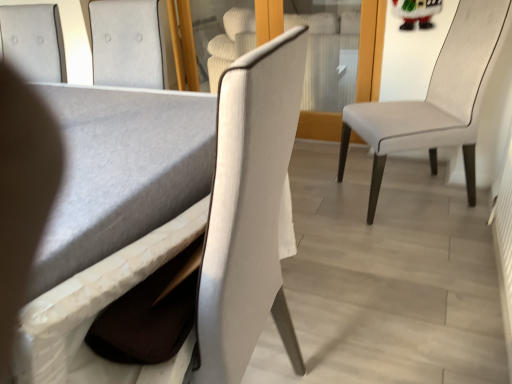
At what (x,y) coordinates should I click in order to perform the action: click on white leather chair at right, placed as the 1th chair when sorted from right to left. Please return your answer as a coordinate pair (x, y). Looking at the image, I should click on (437, 98).

What do you see at coordinates (33, 41) in the screenshot?
I see `textured gray cushion at upper left, marked as the third chair in a right-to-left arrangement` at bounding box center [33, 41].

Locate an element on the screen. matte gray table at lower left is located at coordinates (121, 171).

Describe the element at coordinates (319, 60) in the screenshot. I see `transparent glass door at center` at that location.

Where is `white leather chair at right, which is counted as the 3th chair, starting from the left`? white leather chair at right, which is counted as the 3th chair, starting from the left is located at coordinates 437,98.

From the image's perspective, which one is positioned higher, matte white chair at center, which ranks as the 2th chair in left-to-right order, or textured gray cushion at upper left, marked as the first chair in a left-to-right arrangement?

From the image's view, textured gray cushion at upper left, marked as the first chair in a left-to-right arrangement, is above.

Which point is more forward, (75, 317) or (24, 26)?

The point (75, 317) is more forward.

Is there a large distance between matte white chair at center, which is counted as the second chair, starting from the right, and textured gray cushion at upper left, marked as the first chair in a left-to-right arrangement?

No, there isn't a large distance between matte white chair at center, which is counted as the second chair, starting from the right, and textured gray cushion at upper left, marked as the first chair in a left-to-right arrangement.

Is matte white chair at center, which is counted as the second chair, starting from the right, taller or shorter than transparent glass door at center?

Considering their sizes, matte white chair at center, which is counted as the second chair, starting from the right, has more height than transparent glass door at center.

What's the angular difference between matte white chair at center, which is counted as the second chair, starting from the right, and transparent glass door at center's facing directions?

The angular difference between matte white chair at center, which is counted as the second chair, starting from the right, and transparent glass door at center is 92.2 degrees.

Considering the points (232, 283) and (311, 120), which point is behind, point (232, 283) or point (311, 120)?

The point (311, 120) is farther.

From the image's perspective, which is below, matte white chair at center, which is counted as the second chair, starting from the right, or transparent glass door at center?

matte white chair at center, which is counted as the second chair, starting from the right, from the image's perspective.

Is point (110, 148) more distant than point (307, 99)?

No, it is not.

Does matte gray table at lower left have a larger size compared to transparent glass door at center?

Actually, matte gray table at lower left might be smaller than transparent glass door at center.

Are matte gray table at lower left and transparent glass door at center located far from each other?

matte gray table at lower left is positioned a significant distance from transparent glass door at center.

Are transparent glass door at center and white leather chair at right, placed as the 1th chair when sorted from right to left, far apart?

No.

Where is `glass door on the left of the white leather chair at right, which is counted as the 3th chair, starting from the left`? glass door on the left of the white leather chair at right, which is counted as the 3th chair, starting from the left is located at coordinates pyautogui.click(x=319, y=60).

How far apart are transparent glass door at center and white leather chair at right, which is counted as the 3th chair, starting from the left?

transparent glass door at center is 27.21 inches away from white leather chair at right, which is counted as the 3th chair, starting from the left.

Considering the relative sizes of transparent glass door at center and white leather chair at right, placed as the 1th chair when sorted from right to left, in the image provided, is transparent glass door at center taller than white leather chair at right, placed as the 1th chair when sorted from right to left,?

Incorrect, the height of transparent glass door at center is not larger of that of white leather chair at right, placed as the 1th chair when sorted from right to left.

Relative to white leather chair at right, which is counted as the 3th chair, starting from the left, is matte white chair at center, which is counted as the second chair, starting from the right, in front or behind?

Clearly, matte white chair at center, which is counted as the second chair, starting from the right, is in front of white leather chair at right, which is counted as the 3th chair, starting from the left.

From the image's perspective, between matte white chair at center, which is counted as the second chair, starting from the right, and white leather chair at right, which is counted as the 3th chair, starting from the left, who is located below?

From the image's view, matte white chair at center, which is counted as the second chair, starting from the right, is below.

Does point (211, 169) appear closer or farther from the camera than point (430, 121)?

Point (211, 169) is closer to the camera than point (430, 121).

Is textured gray cushion at upper left, marked as the third chair in a right-to-left arrangement, positioned with its back to matte white chair at center, which is counted as the second chair, starting from the right?

textured gray cushion at upper left, marked as the third chair in a right-to-left arrangement, is not turned away from matte white chair at center, which is counted as the second chair, starting from the right.

Who is bigger, textured gray cushion at upper left, marked as the third chair in a right-to-left arrangement, or matte white chair at center, which is counted as the second chair, starting from the right?

matte white chair at center, which is counted as the second chair, starting from the right.

What are the coordinates of `chair to the left of matte gray table at lower left` in the screenshot? It's located at coord(33,41).

Which object is wider, matte gray table at lower left or textured gray cushion at upper left, marked as the first chair in a left-to-right arrangement?

With larger width is matte gray table at lower left.

How different are the orientations of matte gray table at lower left and textured gray cushion at upper left, marked as the third chair in a right-to-left arrangement, in degrees?

0.205 degrees separate the facing orientations of matte gray table at lower left and textured gray cushion at upper left, marked as the third chair in a right-to-left arrangement.

How distant is matte gray table at lower left from textured gray cushion at upper left, marked as the first chair in a left-to-right arrangement?

matte gray table at lower left and textured gray cushion at upper left, marked as the first chair in a left-to-right arrangement, are 61.37 centimeters apart from each other.

The width and height of the screenshot is (512, 384). Find the location of `chair above the matte white chair at center, which ranks as the 2th chair in left-to-right order (from a real-world perspective)`. chair above the matte white chair at center, which ranks as the 2th chair in left-to-right order (from a real-world perspective) is located at coordinates (33, 41).

Where is `the 3rd chair in front of the transparent glass door at center`? the 3rd chair in front of the transparent glass door at center is located at coordinates (190, 234).

Estimate the real-world distances between objects in this image. Which object is closer to transparent glass door at center, textured gray cushion at upper left, marked as the third chair in a right-to-left arrangement, or matte white chair at center, which is counted as the second chair, starting from the right?

Among the two, textured gray cushion at upper left, marked as the third chair in a right-to-left arrangement, is located nearer to transparent glass door at center.

Estimate the real-world distances between objects in this image. Which object is closer to matte gray table at lower left, transparent glass door at center or textured gray cushion at upper left, marked as the third chair in a right-to-left arrangement?

textured gray cushion at upper left, marked as the third chair in a right-to-left arrangement, lies closer to matte gray table at lower left than the other object.

Estimate the real-world distances between objects in this image. Which object is closer to matte white chair at center, which is counted as the second chair, starting from the right, textured gray cushion at upper left, marked as the first chair in a left-to-right arrangement, or transparent glass door at center?

The object closer to matte white chair at center, which is counted as the second chair, starting from the right, is textured gray cushion at upper left, marked as the first chair in a left-to-right arrangement.

When comparing their distances from matte gray table at lower left, does transparent glass door at center or white leather chair at right, placed as the 1th chair when sorted from right to left, seem closer?

The object closer to matte gray table at lower left is white leather chair at right, placed as the 1th chair when sorted from right to left.

Estimate the real-world distances between objects in this image. Which object is further from transparent glass door at center, matte white chair at center, which is counted as the second chair, starting from the right, or matte gray table at lower left?

matte white chair at center, which is counted as the second chair, starting from the right.

Consider the image. Considering their positions, is matte gray table at lower left positioned further to matte white chair at center, which ranks as the 2th chair in left-to-right order, than textured gray cushion at upper left, marked as the first chair in a left-to-right arrangement?

textured gray cushion at upper left, marked as the first chair in a left-to-right arrangement, is further to matte white chair at center, which ranks as the 2th chair in left-to-right order.

When comparing their distances from matte white chair at center, which ranks as the 2th chair in left-to-right order, does white leather chair at right, which is counted as the 3th chair, starting from the left, or matte gray table at lower left seem further?

white leather chair at right, which is counted as the 3th chair, starting from the left, is further to matte white chair at center, which ranks as the 2th chair in left-to-right order.

Estimate the real-world distances between objects in this image. Which object is further from transparent glass door at center, textured gray cushion at upper left, marked as the third chair in a right-to-left arrangement, or white leather chair at right, placed as the 1th chair when sorted from right to left?

Among the two, textured gray cushion at upper left, marked as the third chair in a right-to-left arrangement, is located further to transparent glass door at center.

Locate an element on the screen. glass door between matte gray table at lower left and white leather chair at right, placed as the 1th chair when sorted from right to left, from left to right is located at coordinates (319, 60).

Image resolution: width=512 pixels, height=384 pixels. Identify the location of glass door between textured gray cushion at upper left, marked as the third chair in a right-to-left arrangement, and white leather chair at right, placed as the 1th chair when sorted from right to left, in the horizontal direction. (319, 60).

You are a GUI agent. You are given a task and a screenshot of the screen. Output one action in this format:
    pyautogui.click(x=<x>, y=<y>)
    Task: Click on the chair situated between textured gray cushion at upper left, marked as the third chair in a right-to-left arrangement, and white leather chair at right, which is counted as the 3th chair, starting from the left, from left to right
    This screenshot has height=384, width=512.
    Given the screenshot: What is the action you would take?
    pyautogui.click(x=190, y=234)

The image size is (512, 384). In order to click on chair situated between matte gray table at lower left and white leather chair at right, placed as the 1th chair when sorted from right to left, from left to right in this screenshot , I will do `click(190, 234)`.